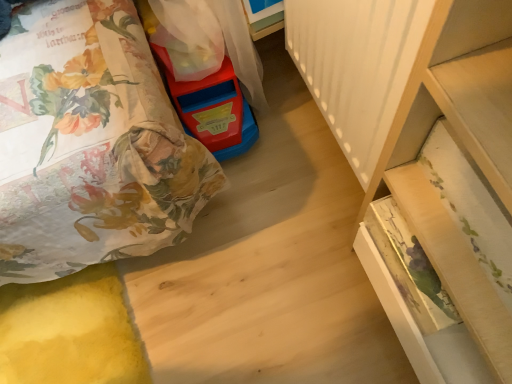
The image size is (512, 384). Describe the element at coordinates (460, 148) in the screenshot. I see `wooden drawer at lower right` at that location.

Where is `wooden drawer at lower right`? wooden drawer at lower right is located at coordinates (460, 148).

Where is `rubberized plastic toy at upper left`? The image size is (512, 384). rubberized plastic toy at upper left is located at coordinates (215, 112).

What do you see at coordinates (215, 112) in the screenshot? I see `rubberized plastic toy at upper left` at bounding box center [215, 112].

At what (x,y) coordinates should I click in order to perform the action: click on wooden drawer at lower right. Please return your answer as a coordinate pair (x, y). This screenshot has height=384, width=512. Looking at the image, I should click on (460, 148).

Is rubberized plastic toy at upper left at the right side of wooden drawer at lower right?

No, rubberized plastic toy at upper left is not to the right of wooden drawer at lower right.

Is rubberized plastic toy at upper left positioned before wooden drawer at lower right?

No, it is behind wooden drawer at lower right.

Does point (209, 111) appear closer or farther from the camera than point (332, 121)?

Point (209, 111) is farther from the camera than point (332, 121).

From the image's perspective, between rubberized plastic toy at upper left and wooden drawer at lower right, which one is located above?

From the image's view, rubberized plastic toy at upper left is above.

From a real-world perspective, is rubberized plastic toy at upper left physically located above or below wooden drawer at lower right?

rubberized plastic toy at upper left is below wooden drawer at lower right.

Which of these two, rubberized plastic toy at upper left or wooden drawer at lower right, is wider?

rubberized plastic toy at upper left.

Is rubberized plastic toy at upper left taller than wooden drawer at lower right?

In fact, rubberized plastic toy at upper left may be shorter than wooden drawer at lower right.

Does rubberized plastic toy at upper left have a larger size compared to wooden drawer at lower right?

No, rubberized plastic toy at upper left is not bigger than wooden drawer at lower right.

Is rubberized plastic toy at upper left inside the boundaries of wooden drawer at lower right, or outside?

rubberized plastic toy at upper left cannot be found inside wooden drawer at lower right.

Is rubberized plastic toy at upper left positioned far away from wooden drawer at lower right?

No, rubberized plastic toy at upper left is in close proximity to wooden drawer at lower right.

Is wooden drawer at lower right at the back of rubberized plastic toy at upper left?

No, wooden drawer at lower right is not at the back of rubberized plastic toy at upper left.

Looking at this image, how far apart are rubberized plastic toy at upper left and wooden drawer at lower right?

The distance of rubberized plastic toy at upper left from wooden drawer at lower right is 14.79 inches.

Identify the location of furniture to the right of rubberized plastic toy at upper left. (460, 148).

Does wooden drawer at lower right appear on the right side of rubberized plastic toy at upper left?

Yes.

Which object is closer to the camera, wooden drawer at lower right or rubberized plastic toy at upper left?

wooden drawer at lower right is more forward.

Which point is more forward, (385, 160) or (240, 133)?

The point (385, 160) is closer.

From the image's perspective, which one is positioned higher, wooden drawer at lower right or rubberized plastic toy at upper left?

rubberized plastic toy at upper left is shown above in the image.

From a real-world perspective, relative to rubberized plastic toy at upper left, is wooden drawer at lower right vertically above or below?

wooden drawer at lower right is above rubberized plastic toy at upper left.

Considering the sizes of objects wooden drawer at lower right and rubberized plastic toy at upper left in the image provided, who is wider, wooden drawer at lower right or rubberized plastic toy at upper left?

With larger width is rubberized plastic toy at upper left.

Considering the sizes of wooden drawer at lower right and rubberized plastic toy at upper left in the image, is wooden drawer at lower right taller or shorter than rubberized plastic toy at upper left?

wooden drawer at lower right is taller than rubberized plastic toy at upper left.

Can you confirm if wooden drawer at lower right is smaller than rubberized plastic toy at upper left?

Incorrect, wooden drawer at lower right is not smaller in size than rubberized plastic toy at upper left.

Is wooden drawer at lower right positioned beyond the bounds of rubberized plastic toy at upper left?

wooden drawer at lower right lies outside rubberized plastic toy at upper left's area.

Is wooden drawer at lower right directly adjacent to rubberized plastic toy at upper left?

There is a gap between wooden drawer at lower right and rubberized plastic toy at upper left.

Is wooden drawer at lower right oriented towards rubberized plastic toy at upper left?

No, wooden drawer at lower right is not facing towards rubberized plastic toy at upper left.

Measure the distance between wooden drawer at lower right and rubberized plastic toy at upper left.

wooden drawer at lower right and rubberized plastic toy at upper left are 14.79 inches apart from each other.

Where is `furniture above the rubberized plastic toy at upper left (from a real-world perspective)`? This screenshot has height=384, width=512. furniture above the rubberized plastic toy at upper left (from a real-world perspective) is located at coordinates (460, 148).

The image size is (512, 384). Find the location of `furniture in front of the rubberized plastic toy at upper left`. furniture in front of the rubberized plastic toy at upper left is located at coordinates (460, 148).

You are a GUI agent. You are given a task and a screenshot of the screen. Output one action in this format:
    pyautogui.click(x=<x>, y=<y>)
    Task: Click on the toy behind the wooden drawer at lower right
    The image size is (512, 384).
    Given the screenshot: What is the action you would take?
    pyautogui.click(x=215, y=112)